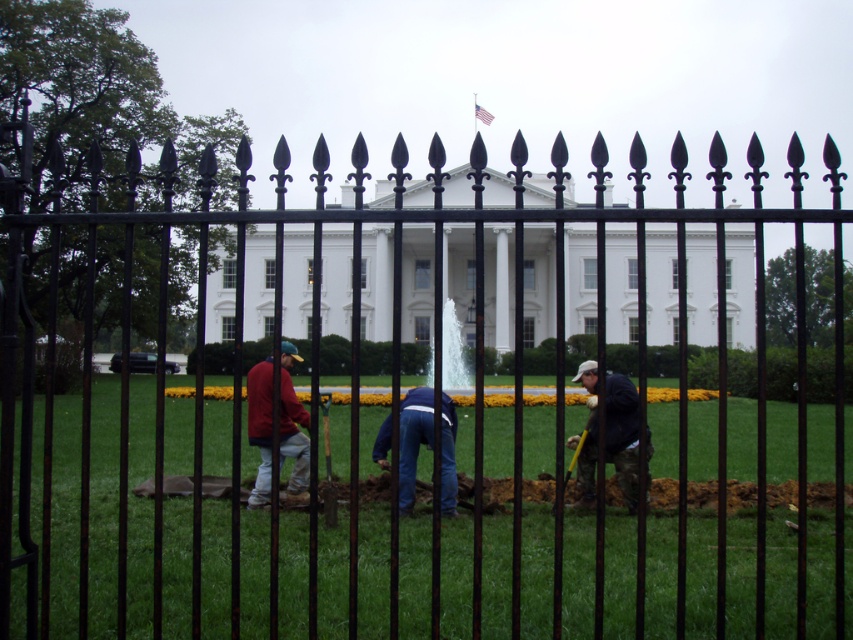
You are standing outside the black wrought iron fence and see the matte red shirt at center and the yellow plastic shovel at center through the fence. Which object appears taller when viewed from your position?

The matte red shirt at center appears taller than the yellow plastic shovel at center when viewed from your position outside the black wrought iron fence.

From the picture: You are trying to determine which object is covering the other between the blue jeans at center and the yellow plastic shovel at center. Based on the scene description, which one is on top?

The blue jeans at center is positioned over yellow plastic shovel at center, so the blue jeans at center is on top.

You are standing in front of the black wrought iron fence and want to reach the point at coordinates point (583, 502) on the lawn. If your maximum comfortable walking distance is 30 feet, can you comfortably walk to that point without feeling too tired?

The distance of point (583, 502) from viewer is 36.20 feet, which exceeds your maximum comfortable walking distance of 30 feet. Therefore, walking to that point may cause fatigue.